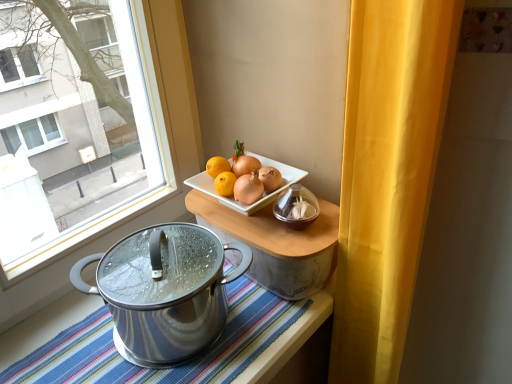
What are the coordinates of `free space above striped fabric tablecloth at lower center (from a real-world perspective)` in the screenshot? It's located at (154, 335).